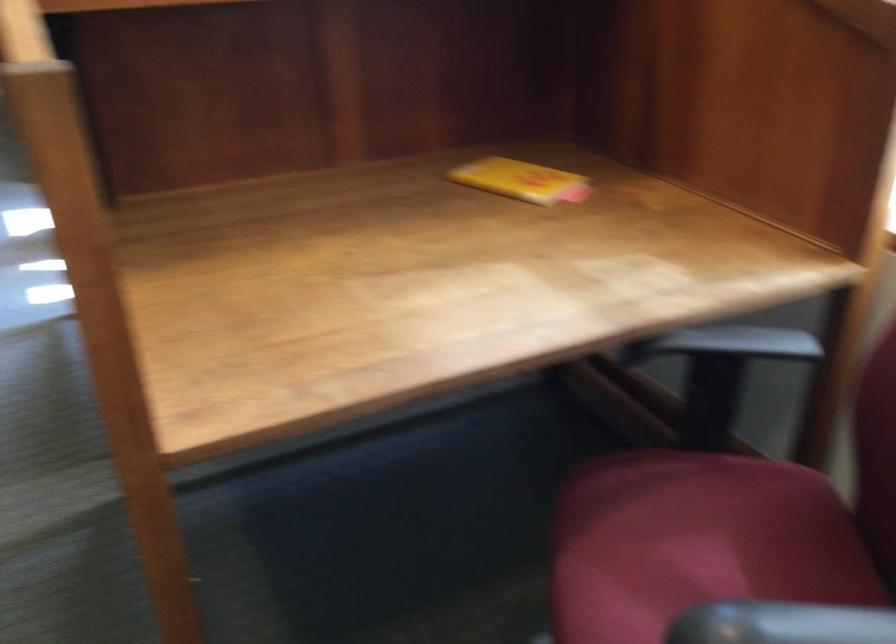
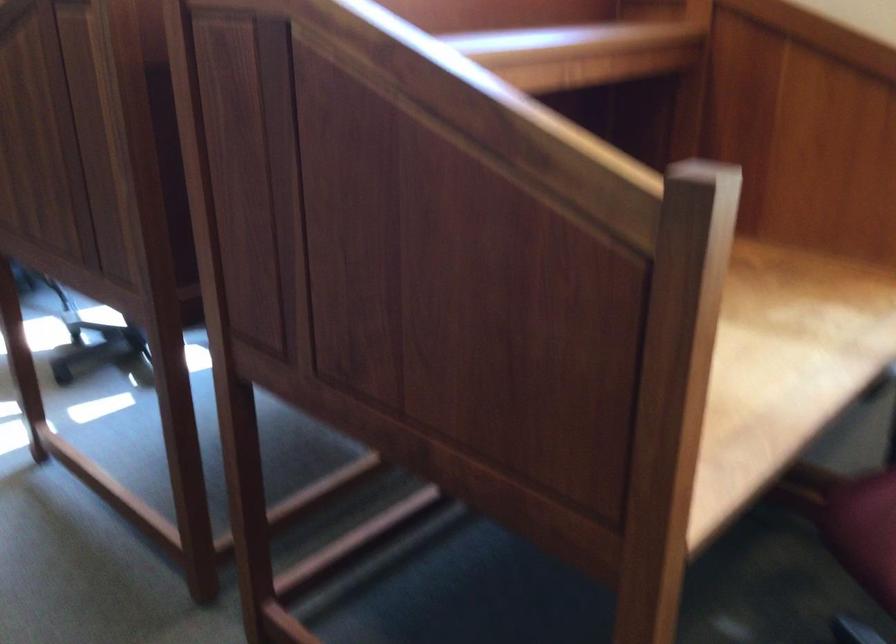
Find the pixel in the second image that matches point (515, 308) in the first image.

(778, 360)